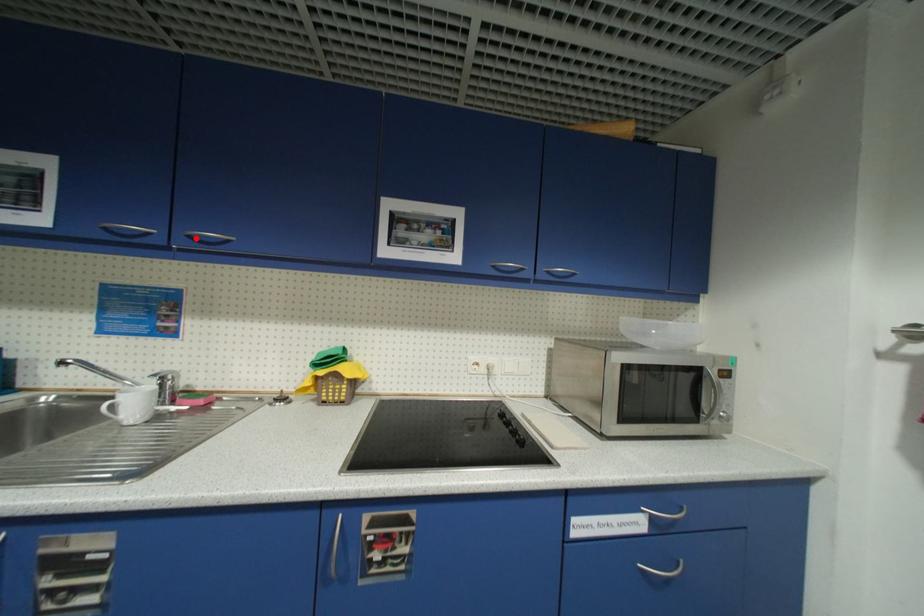
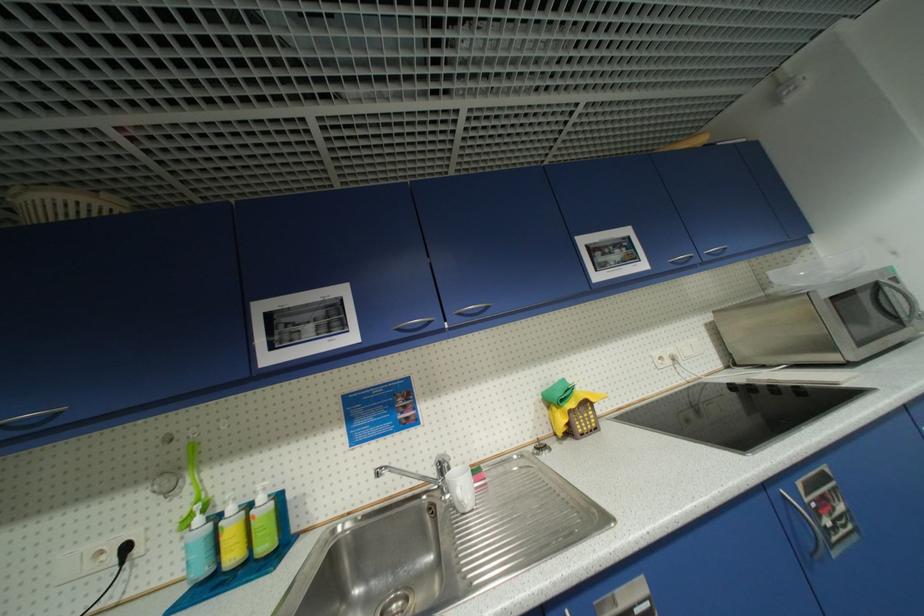
Find the pixel in the second image that matches the highlighted location in the first image.

(466, 315)